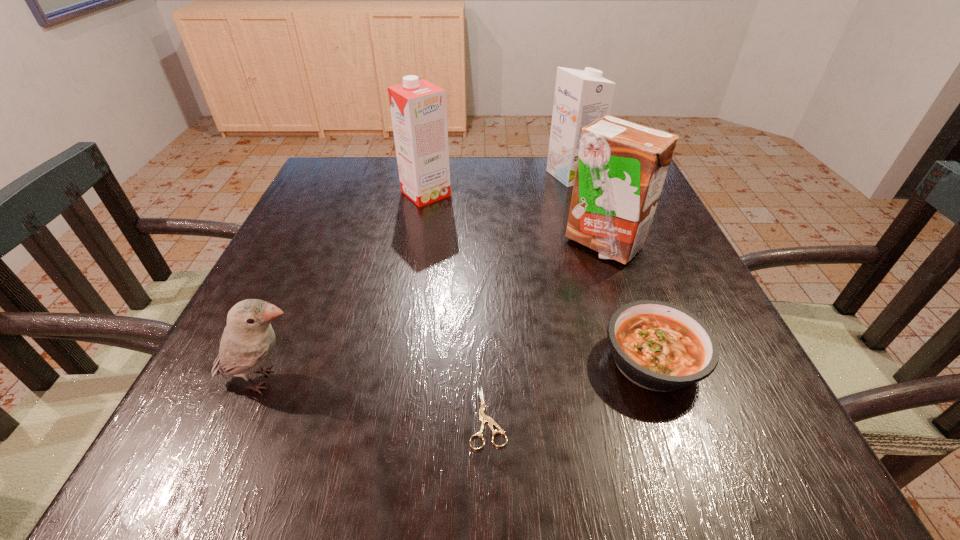
The height and width of the screenshot is (540, 960). I want to click on blank space located 0.080m on the left of the second shortest object, so click(x=554, y=361).

This screenshot has width=960, height=540. In order to click on free location located on the right of the shortest object in this screenshot , I will do `click(566, 417)`.

Locate an element on the screen. The height and width of the screenshot is (540, 960). object situated at the near edge is located at coordinates (483, 417).

Locate an element on the screen. object located at the left edge is located at coordinates (248, 340).

At what (x,y) coordinates should I click in order to perform the action: click on stew located in the right edge section of the desktop. Please return your answer as a coordinate pair (x, y). This screenshot has height=540, width=960. Looking at the image, I should click on (659, 346).

This screenshot has width=960, height=540. I want to click on object located at the far right corner, so click(x=581, y=97).

Where is `vacant space at the far edge of the desktop`? This screenshot has width=960, height=540. vacant space at the far edge of the desktop is located at coordinates (489, 193).

Find the location of `vacant area at the near edge`. vacant area at the near edge is located at coordinates (612, 469).

This screenshot has height=540, width=960. I want to click on vacant space at the left edge of the desktop, so click(x=199, y=387).

I want to click on free space at the right edge of the desktop, so click(662, 291).